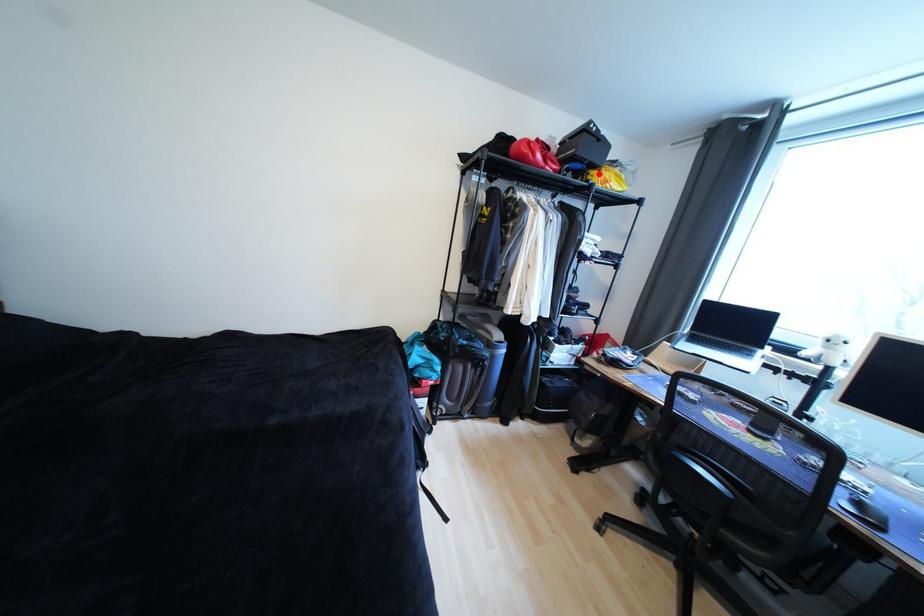
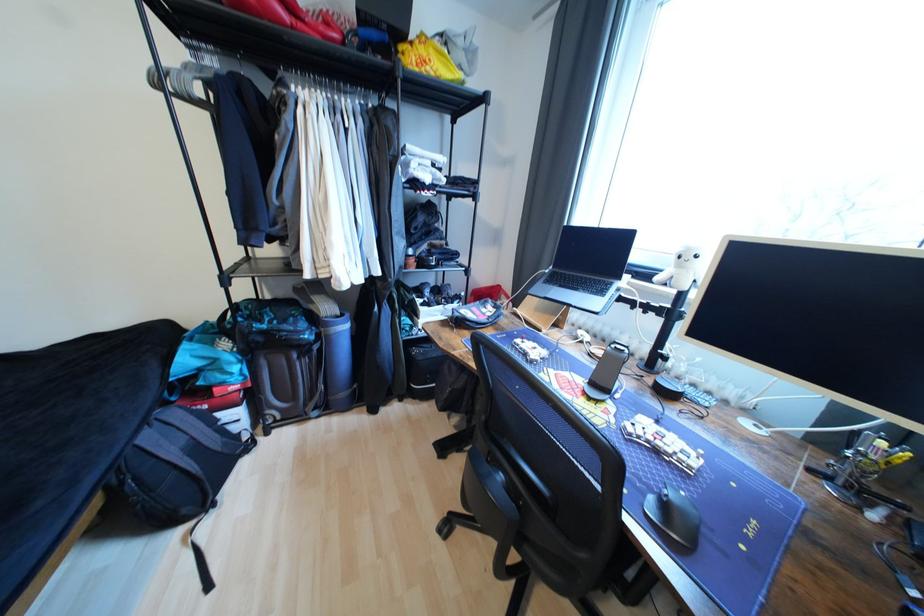
The point at the highlighted location is marked in the first image. Where is the corresponding point in the second image?

(407, 49)